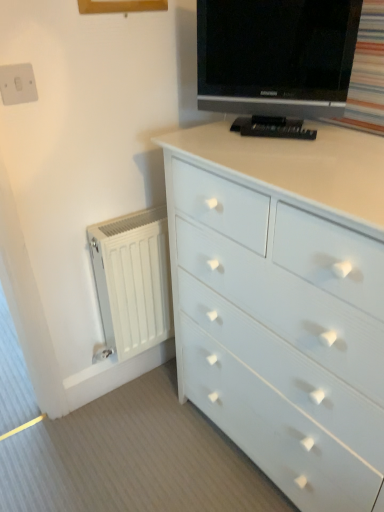
Describe the element at coordinates (17, 84) in the screenshot. I see `white plastic switch at upper left` at that location.

In order to face black glossy tv at upper center, should I rotate leftwards or rightwards?

Turn right by 11.001 degrees to look at black glossy tv at upper center.

In order to face white painted wood chest of drawers at center, should I rotate leftwards or rightwards?

It's best to rotate right around 14.748 degrees.

The image size is (384, 512). What do you see at coordinates (133, 280) in the screenshot?
I see `white matte radiator at left` at bounding box center [133, 280].

Where is `white plastic switch at upper left`? The width and height of the screenshot is (384, 512). white plastic switch at upper left is located at coordinates (17, 84).

In terms of height, does black glossy tv at upper center look taller or shorter compared to white plastic switch at upper left?

Considering their sizes, black glossy tv at upper center has more height than white plastic switch at upper left.

Are black glossy tv at upper center and white plastic switch at upper left beside each other?

black glossy tv at upper center and white plastic switch at upper left are not in contact.

Is white plastic switch at upper left surrounded by black glossy tv at upper center?

No, black glossy tv at upper center does not contain white plastic switch at upper left.

Is black glossy tv at upper center positioned before white plastic switch at upper left?

That is True.

Image resolution: width=384 pixels, height=512 pixels. What are the coordinates of `the chest of drawers in front of the white matte radiator at left` in the screenshot? It's located at (283, 304).

Choose the correct answer: Is white matte radiator at left inside white painted wood chest of drawers at center or outside it?

white matte radiator at left cannot be found inside white painted wood chest of drawers at center.

From the image's perspective, is white matte radiator at left above or below white painted wood chest of drawers at center?

white matte radiator at left is above white painted wood chest of drawers at center.

Is point (156, 321) positioned behind point (316, 288)?

Yes.

Can we say white plastic switch at upper left lies outside white matte radiator at left?

That's correct, white plastic switch at upper left is outside of white matte radiator at left.

Where is `electric outlet in front of the white matte radiator at left`? The image size is (384, 512). electric outlet in front of the white matte radiator at left is located at coordinates (17, 84).

Is white plastic switch at upper left beside white matte radiator at left?

No, white plastic switch at upper left is not with white matte radiator at left.

From the image's perspective, does white plastic switch at upper left appear lower than white matte radiator at left?

No, from the image's perspective, white plastic switch at upper left is not below white matte radiator at left.

From the image's perspective, who appears lower, white plastic switch at upper left or black glossy tv at upper center?

From the image's view, white plastic switch at upper left is below.

Looking at this image, is white plastic switch at upper left beside black glossy tv at upper center?

No, white plastic switch at upper left is not touching black glossy tv at upper center.

Find the location of `television that appears in front of the white plastic switch at upper left`. television that appears in front of the white plastic switch at upper left is located at coordinates (276, 56).

Consider the image. Does white painted wood chest of drawers at center have a smaller size compared to white matte radiator at left?

Actually, white painted wood chest of drawers at center might be larger than white matte radiator at left.

From a real-world perspective, is white painted wood chest of drawers at center located higher than white matte radiator at left?

Yes, from a real-world perspective, white painted wood chest of drawers at center is over white matte radiator at left

Is point (224, 226) farther from camera compared to point (114, 251)?

No, it is in front of (114, 251).

You are a GUI agent. You are given a task and a screenshot of the screen. Output one action in this format:
    pyautogui.click(x=<x>, y=<y>)
    Task: Click on the radiator that is behind the white painted wood chest of drawers at center
    The height and width of the screenshot is (512, 384).
    Given the screenshot: What is the action you would take?
    pyautogui.click(x=133, y=280)

Between white painted wood chest of drawers at center and black glossy tv at upper center, which one has more height?

Standing taller between the two is white painted wood chest of drawers at center.

Find the location of a particular element. chest of drawers below the black glossy tv at upper center (from a real-world perspective) is located at coordinates (283, 304).

Is black glossy tv at upper center at the back of white painted wood chest of drawers at center?

No, white painted wood chest of drawers at center is not facing the opposite direction of black glossy tv at upper center.

Choose the correct answer: Is white matte radiator at left inside white plastic switch at upper left or outside it?

white matte radiator at left is spatially situated outside white plastic switch at upper left.

From a real-world perspective, is white matte radiator at left under white plastic switch at upper left?

Yes, from a real-world perspective, white matte radiator at left is beneath white plastic switch at upper left.

Based on the photo, who is bigger, white matte radiator at left or white plastic switch at upper left?

white matte radiator at left is bigger.

Is white matte radiator at left shorter than white plastic switch at upper left?

Incorrect, the height of white matte radiator at left does not fall short of that of white plastic switch at upper left.

At what (x,y) coordinates should I click in order to perform the action: click on electric outlet below the black glossy tv at upper center (from the image's perspective). Please return your answer as a coordinate pair (x, y). Looking at the image, I should click on (17, 84).

I want to click on chest of drawers on the right of white matte radiator at left, so click(x=283, y=304).

Considering their positions, is white matte radiator at left positioned further to white painted wood chest of drawers at center than white plastic switch at upper left?

Based on the image, white plastic switch at upper left appears to be further to white painted wood chest of drawers at center.

Looking at the image, which one is located further to white painted wood chest of drawers at center, black glossy tv at upper center or white plastic switch at upper left?

Among the two, white plastic switch at upper left is located further to white painted wood chest of drawers at center.

Looking at the image, which one is located further to white plastic switch at upper left, white painted wood chest of drawers at center or black glossy tv at upper center?

The object further to white plastic switch at upper left is white painted wood chest of drawers at center.

Which object lies nearer to the anchor point white plastic switch at upper left, white matte radiator at left or white painted wood chest of drawers at center?

The object closer to white plastic switch at upper left is white matte radiator at left.

Estimate the real-world distances between objects in this image. Which object is closer to black glossy tv at upper center, white matte radiator at left or white painted wood chest of drawers at center?

white painted wood chest of drawers at center is closer to black glossy tv at upper center.

From the image, which object appears to be farther from white plastic switch at upper left, white matte radiator at left or black glossy tv at upper center?

white matte radiator at left is further to white plastic switch at upper left.

Looking at the image, which one is located closer to white painted wood chest of drawers at center, white matte radiator at left or black glossy tv at upper center?

black glossy tv at upper center is closer to white painted wood chest of drawers at center.

When comparing their distances from white matte radiator at left, does black glossy tv at upper center or white painted wood chest of drawers at center seem closer?

Among the two, white painted wood chest of drawers at center is located nearer to white matte radiator at left.

Where is `radiator between white plastic switch at upper left and white painted wood chest of drawers at center in the horizontal direction`? radiator between white plastic switch at upper left and white painted wood chest of drawers at center in the horizontal direction is located at coordinates (133, 280).

Where is `electric outlet between black glossy tv at upper center and white matte radiator at left from top to bottom`? electric outlet between black glossy tv at upper center and white matte radiator at left from top to bottom is located at coordinates (17, 84).

Find the location of a particular element. radiator between black glossy tv at upper center and white painted wood chest of drawers at center in the up-down direction is located at coordinates (133, 280).

You are a GUI agent. You are given a task and a screenshot of the screen. Output one action in this format:
    pyautogui.click(x=<x>, y=<y>)
    Task: Click on the television between white plastic switch at upper left and white painted wood chest of drawers at center from left to right
    
    Given the screenshot: What is the action you would take?
    pos(276,56)